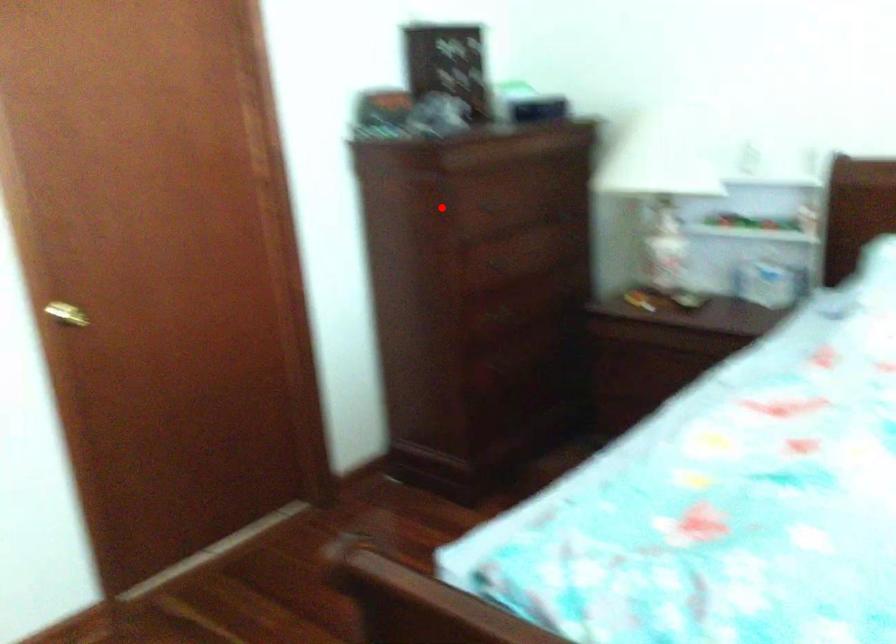
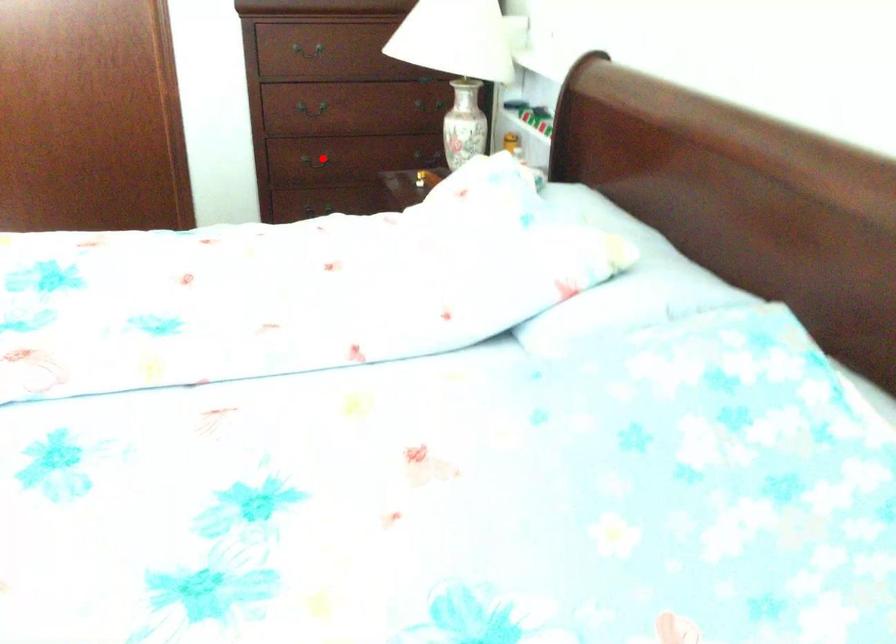
I am providing you with two images of the same scene from different viewpoints. A red point is marked on the first image and another point is marked on the second image. Is the marked point in image1 the same physical position as the marked point in image2?

No